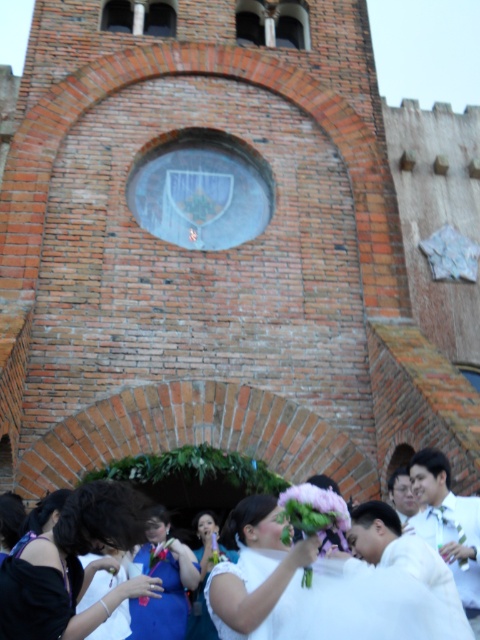
Question: Does white satin dress at center appear on the left side of white satin dress at lower left?

Choices:
 (A) no
 (B) yes

Answer: (A)

Question: Does white satin dress at lower center appear on the left side of pink floral bouquet at center?

Choices:
 (A) yes
 (B) no

Answer: (A)

Question: Which of the following is the closest to the observer?

Choices:
 (A) (179, 636)
 (B) (108, 557)

Answer: (B)

Question: Does blue satin dress at lower left appear over pink floral bouquet at center?

Choices:
 (A) no
 (B) yes

Answer: (A)

Question: Which point is farther to the camera?

Choices:
 (A) (168, 630)
 (B) (284, 628)

Answer: (A)

Question: Which object is positioned farthest from the white satin suit at lower right?

Choices:
 (A) pink floral bouquet at center
 (B) white satin dress at center
 (C) blue satin dress at lower left
 (D) white satin dress at lower center

Answer: (C)